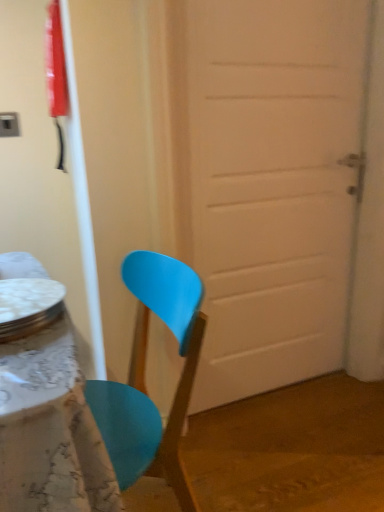
The width and height of the screenshot is (384, 512). What are the coordinates of `white matte door at center` in the screenshot? It's located at (272, 185).

The width and height of the screenshot is (384, 512). Describe the element at coordinates (272, 185) in the screenshot. I see `white matte door at center` at that location.

You are a GUI agent. You are given a task and a screenshot of the screen. Output one action in this format:
    pyautogui.click(x=<x>, y=<y>)
    Task: Click on the white matte door at center
    The height and width of the screenshot is (512, 384).
    Given the screenshot: What is the action you would take?
    pyautogui.click(x=272, y=185)